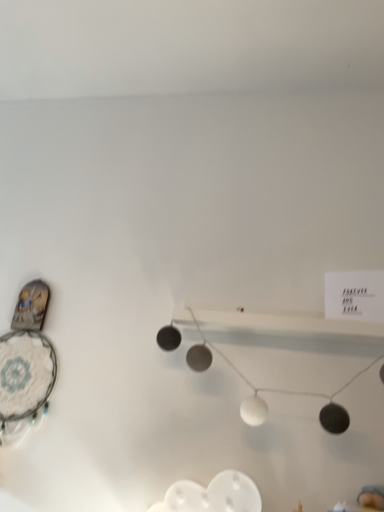
Locate an element on the screen. The width and height of the screenshot is (384, 512). white matte card at upper right is located at coordinates (355, 295).

Image resolution: width=384 pixels, height=512 pixels. What do you see at coordinates (355, 295) in the screenshot? I see `white matte card at upper right` at bounding box center [355, 295].

Find the location of a particular element. The height and width of the screenshot is (512, 384). white matte card at upper right is located at coordinates (355, 295).